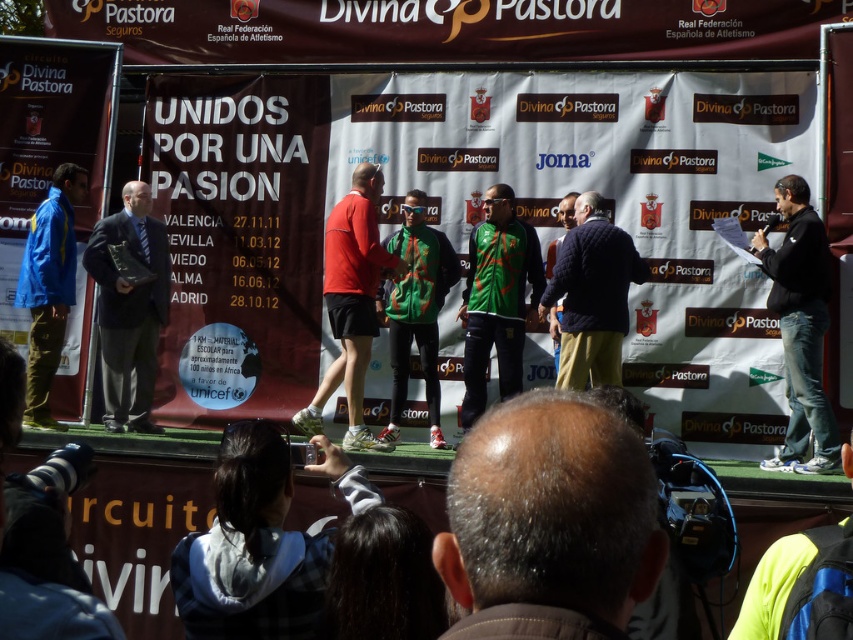
Question: Among these objects, which one is nearest to the camera?

Choices:
 (A) gray hair at center
 (B) neon yellow jacket at lower right

Answer: (A)

Question: Which point is closer to the camera?

Choices:
 (A) gray hair at center
 (B) navy blue sweater at center
 (C) dark blue suit at left
 (D) green matte jersey at center

Answer: (A)

Question: Can you confirm if gray hair at center is positioned above navy blue sweater at center?

Choices:
 (A) yes
 (B) no

Answer: (B)

Question: Does gray hair at center appear on the right side of navy quilted jacket at center?

Choices:
 (A) no
 (B) yes

Answer: (A)

Question: Estimate the real-world distances between objects in this image. Which object is farther from the gray hair at center?

Choices:
 (A) neon yellow jacket at lower right
 (B) black matte jacket at right

Answer: (B)

Question: Is the position of dark blue suit at left more distant than that of navy quilted jacket at center?

Choices:
 (A) yes
 (B) no

Answer: (A)